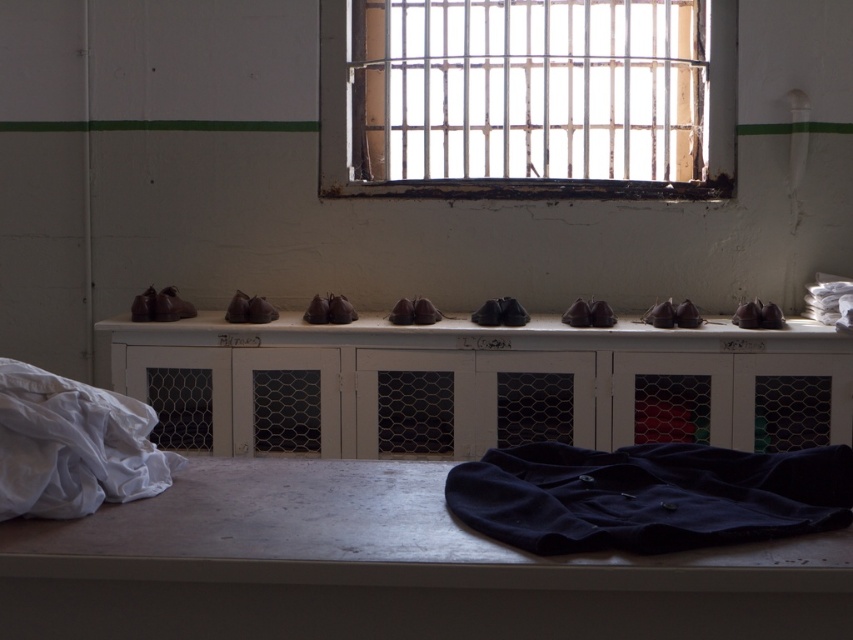
Question: Is metallic bars at upper center further to the viewer compared to white cotton cloth at lower left?

Choices:
 (A) no
 (B) yes

Answer: (B)

Question: Which of the following is the closest to the observer?

Choices:
 (A) white cotton cloth at lower left
 (B) metallic bars at upper center
 (C) metallic gray ledge at lower center

Answer: (C)

Question: Which object is farther from the camera taking this photo?

Choices:
 (A) metallic gray ledge at lower center
 (B) velvet dark blue shirt at center
 (C) white cotton cloth at lower left
 (D) metallic bars at upper center

Answer: (D)

Question: Among these objects, which one is farthest from the camera?

Choices:
 (A) metallic bars at upper center
 (B) metallic gray ledge at lower center
 (C) velvet dark blue shirt at center
 (D) white cotton cloth at lower left

Answer: (A)

Question: Does velvet dark blue shirt at center come behind white cotton cloth at lower left?

Choices:
 (A) no
 (B) yes

Answer: (A)

Question: Does velvet dark blue shirt at center have a greater width compared to white cotton cloth at lower left?

Choices:
 (A) no
 (B) yes

Answer: (B)